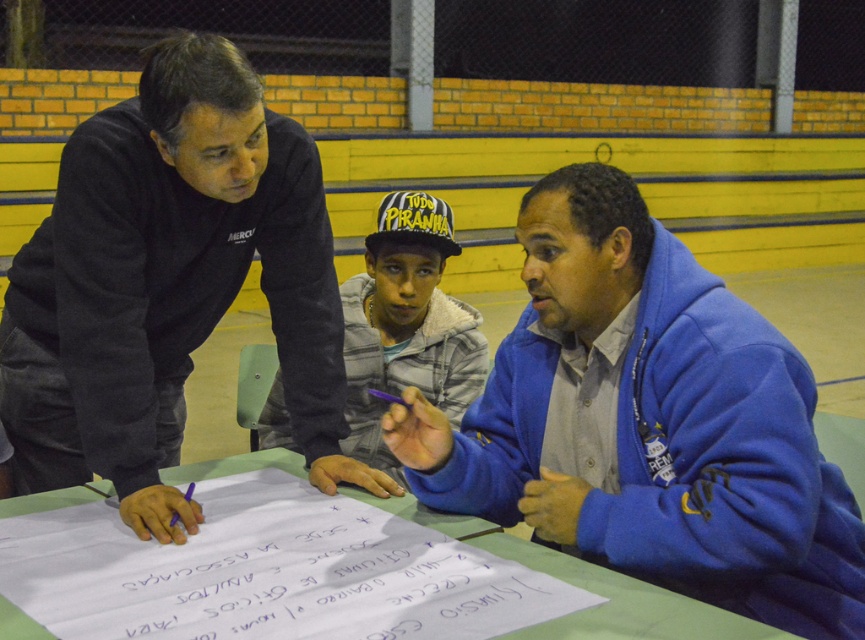
You are a photographer standing at the edge of the field. You need to capture a photo that includes both the dark gray sweatshirt at upper left and the yellow and black baseball cap at center. Which object should be positioned higher in the frame to ensure both are visible?

The dark gray sweatshirt at upper left should be positioned higher in the frame since it has a greater height compared to the yellow and black baseball cap at center, ensuring both are visible.